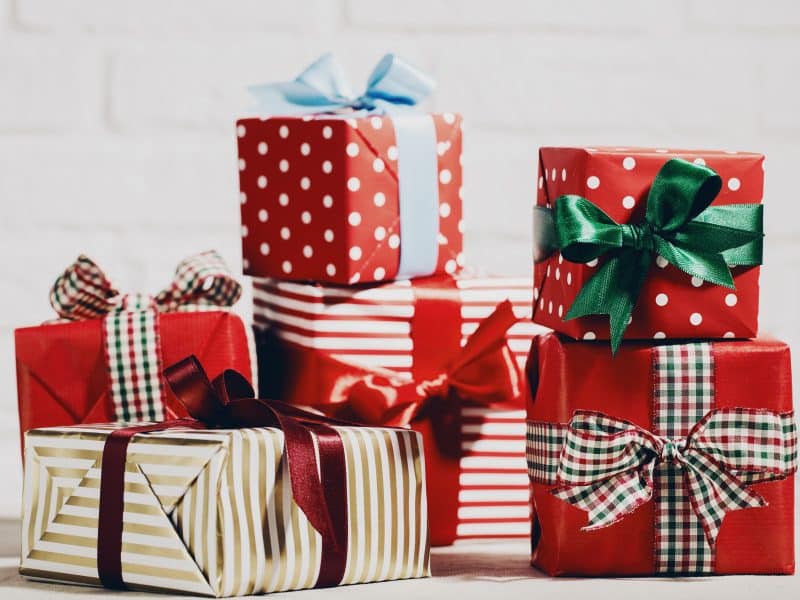
Where is `christmas presents`? Image resolution: width=800 pixels, height=600 pixels. christmas presents is located at coordinates (129, 378), (169, 487), (357, 339), (346, 249), (574, 272), (605, 410).